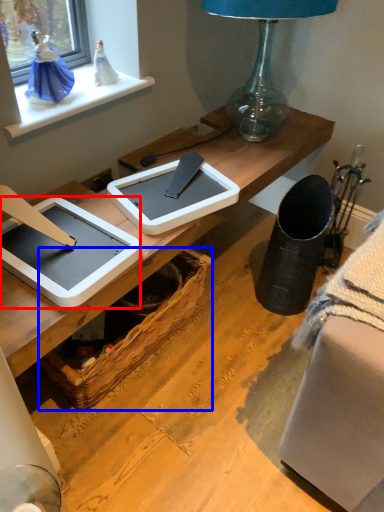
Question: Which of the following is the farthest to the observer, tablet computer (highlighted by a red box) or picnic basket (highlighted by a blue box)?

Choices:
 (A) tablet computer
 (B) picnic basket

Answer: (B)